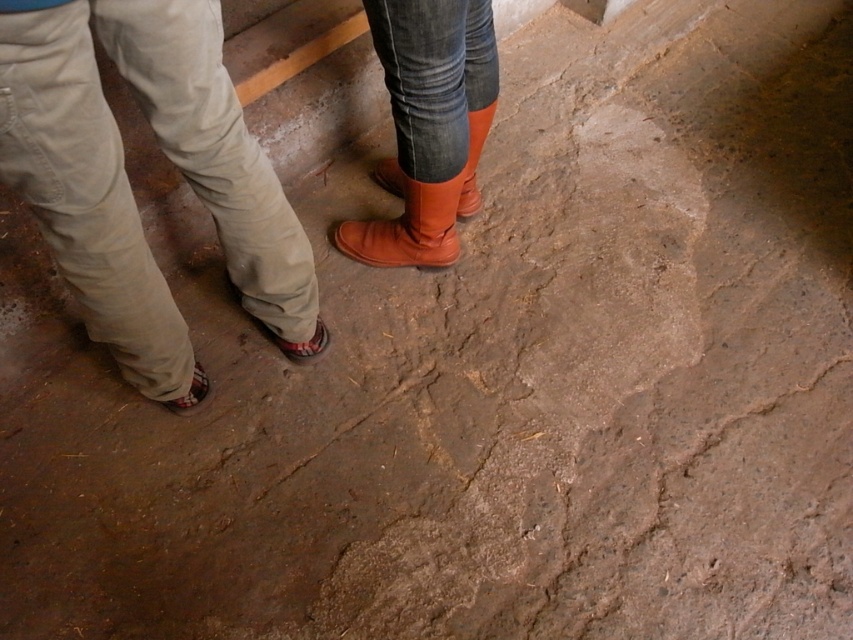
Question: Which object appears closest to the camera in this image?

Choices:
 (A) leather sandal at lower left
 (B) matte leather boot at center
 (C) matte orange boot at center

Answer: (C)

Question: Is khaki pants at left bigger than brown leather boots at center?

Choices:
 (A) yes
 (B) no

Answer: (A)

Question: Which object appears farthest from the camera in this image?

Choices:
 (A) leather boot at center
 (B) khaki pants at left

Answer: (A)

Question: Estimate the real-world distances between objects in this image. Which object is farther from the leather boot at center?

Choices:
 (A) khaki pants at left
 (B) brown leather boots at center
 (C) matte orange boot at center

Answer: (A)

Question: Where is matte orange boot at center located in relation to brown leather sandal at lower left in the image?

Choices:
 (A) below
 (B) above

Answer: (B)

Question: Does khaki pants at left have a smaller size compared to matte orange boot at center?

Choices:
 (A) no
 (B) yes

Answer: (A)